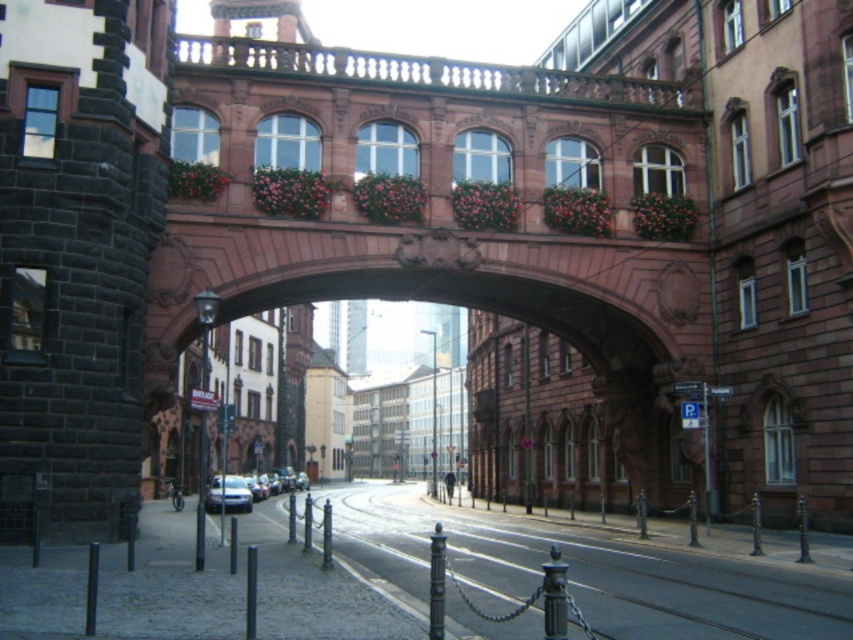
Locate an element on the screen. This screenshot has width=853, height=640. metallic gray train track at lower center is located at coordinates (592, 572).

Is point (413, 577) positioned behind point (207, 508)?

That is False.

Where is `metallic gray train track at lower center`? The width and height of the screenshot is (853, 640). metallic gray train track at lower center is located at coordinates (592, 572).